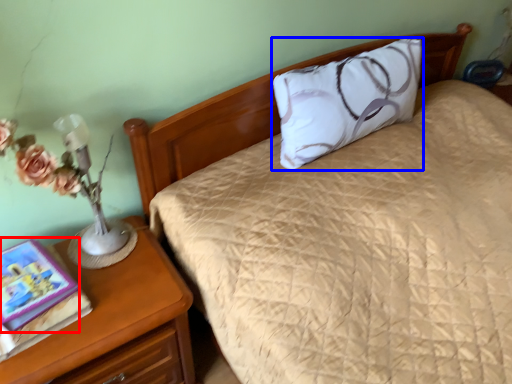
Question: Which object is closer to the camera taking this photo, book (highlighted by a red box) or pillow (highlighted by a blue box)?

Choices:
 (A) book
 (B) pillow

Answer: (A)